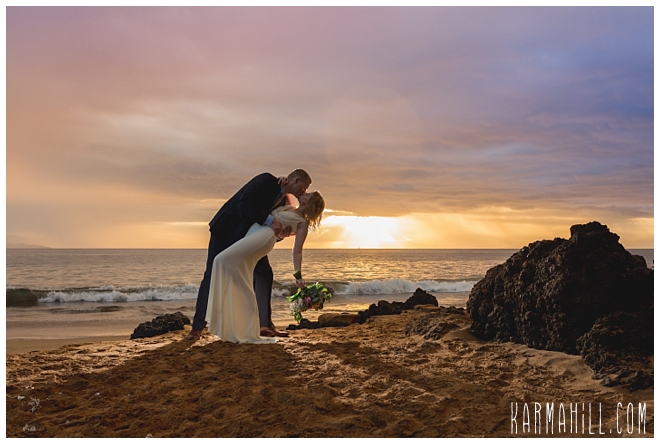
The width and height of the screenshot is (660, 444). I want to click on bouquet, so click(307, 294).